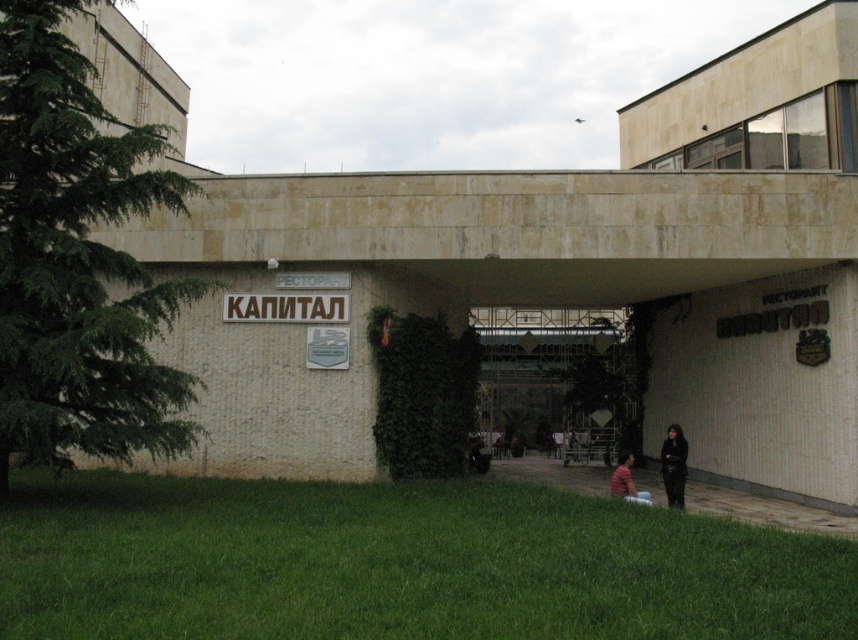
Consider the image. You are standing in front of the building and want to determine the distance between two specific points marked on the facade. The points are labeled as point 1 at coordinates (x=686, y=452) and point 2 at coordinates (x=627, y=461). Based on the scene description, which point is closer to you?

Point 1 at coordinates (x=686, y=452) is closer to the viewer than point 2 at coordinates (x=627, y=461).

You are a delivery person arriving at the restaurant. You need to enter through the transparent glass entrance at center. However, you are wearing a striped cotton shirt at lower center. Can your shirt fit through the entrance without any issues?

The transparent glass entrance at center is smaller than the striped cotton shirt at lower center, so the shirt may not fit through the entrance without adjustments or folding.